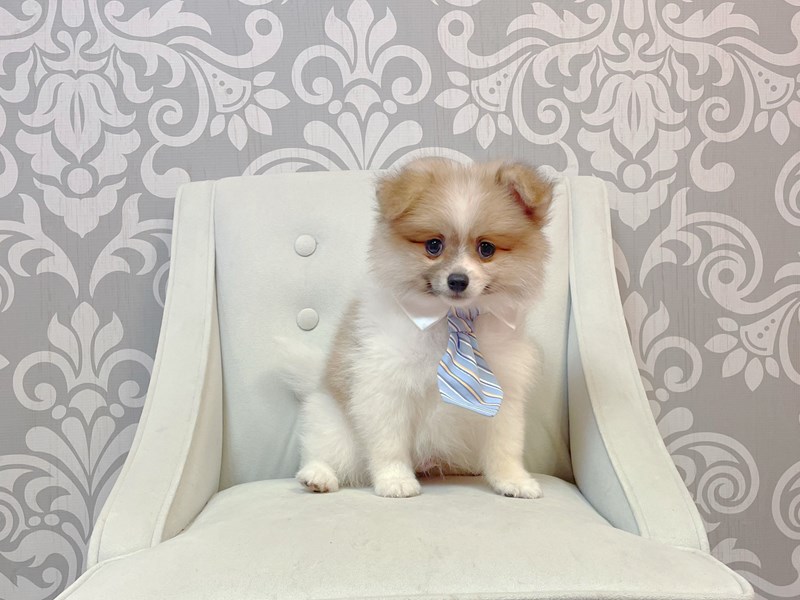
This screenshot has width=800, height=600. Find the location of `armrest`. armrest is located at coordinates (646, 452), (160, 444).